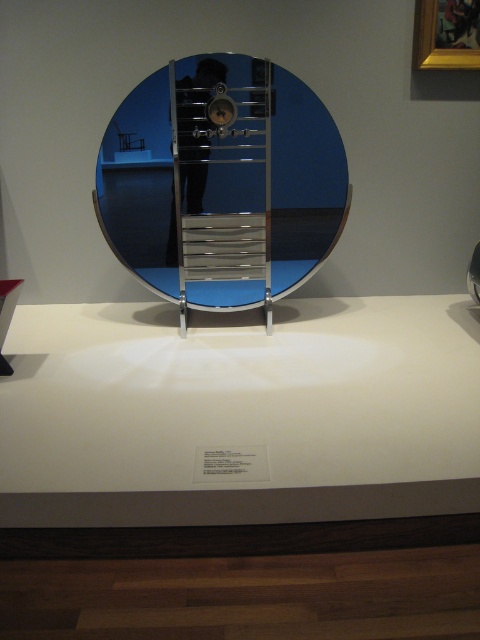
You are an artist planning to place a sculpture on the white glossy counter top at center. The sculpture requires a surface area of 0.6 square meters. Can the counter top accommodate it based on its dimensions?

The white glossy counter top at center has dimensions that need to be assessed. However, the provided information only states its location at point coordinates without specifying its size. Without knowing the length and width, it is impossible to determine if the 0.6 square meters requirement is met. Additional measurements are necessary.

What is located at the coordinates point [240,412] in the image?

The white glossy counter top at center is located at point [240,412].

You are an interior designer assessing the space in front of the white glossy counter top at center and the polished chrome ladder at center. Which object is taller?

The polished chrome ladder at center is taller than the white glossy counter top at center.